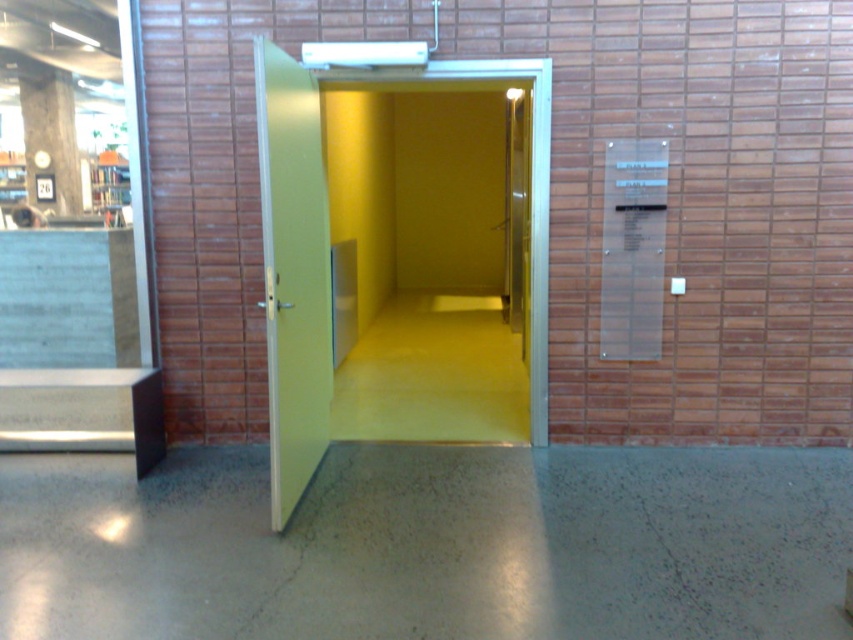
You are standing in the modern architectural interior space. You see a green matte door at center. Where is the green matte door at center located in relation to the point marked at coordinates (x=293, y=273)?

The green matte door at center is exactly at the point marked at coordinates (x=293, y=273).

You are standing in the modern architectural interior space and want to determine the relative positions of two points. Given that point A is at coordinates point (x=270, y=120) and point B is at point (x=45, y=200), which point is closer to you?

Point point (x=270, y=120) is closer to the camera than point point (x=45, y=200).